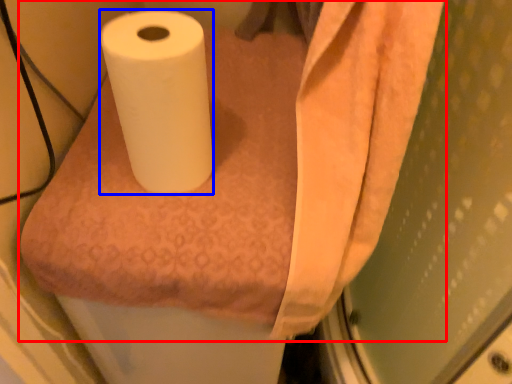
Question: Which object appears closest to the camera in this image, paper towel (highlighted by a red box) or toilet paper (highlighted by a blue box)?

Choices:
 (A) paper towel
 (B) toilet paper

Answer: (B)